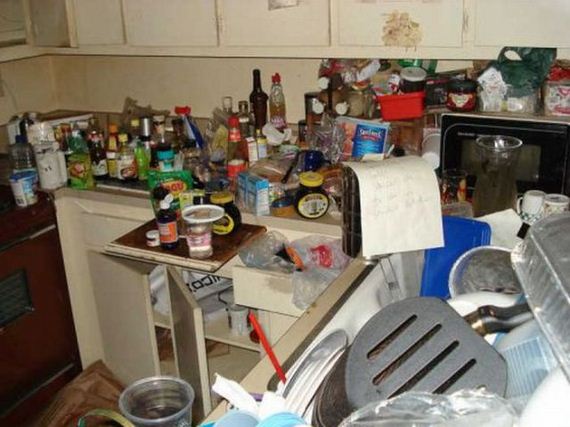
Where is `jar with yellow lid`? This screenshot has width=570, height=427. jar with yellow lid is located at coordinates (313, 202).